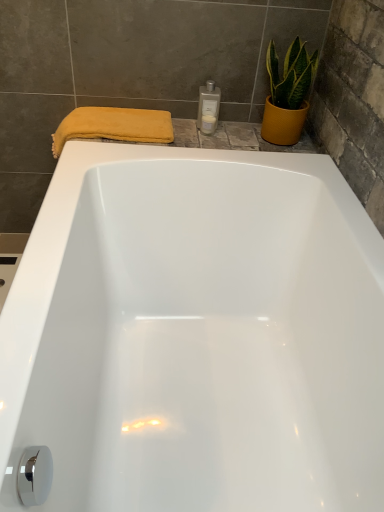
Question: Considering the relative positions of yellow soft towel at upper left and white glossy bottle at upper center, which is the first toiletry from bottom to top, in the image provided, is yellow soft towel at upper left in front of white glossy bottle at upper center, which is the first toiletry from bottom to top,?

Choices:
 (A) no
 (B) yes

Answer: (B)

Question: From a real-world perspective, is yellow soft towel at upper left physically above white glossy bottle at upper center, which is the first toiletry from bottom to top?

Choices:
 (A) no
 (B) yes

Answer: (A)

Question: Considering the relative positions of yellow soft towel at upper left and white glossy bottle at upper center, which is the first toiletry from bottom to top, in the image provided, is yellow soft towel at upper left to the right of white glossy bottle at upper center, which is the first toiletry from bottom to top, from the viewer's perspective?

Choices:
 (A) yes
 (B) no

Answer: (B)

Question: From the image's perspective, is yellow soft towel at upper left above white glossy bottle at upper center, which is the first toiletry from bottom to top?

Choices:
 (A) yes
 (B) no

Answer: (B)

Question: Could white glossy bottle at upper center, the second toiletry positioned from the top, be considered to be inside yellow soft towel at upper left?

Choices:
 (A) yes
 (B) no

Answer: (B)

Question: Considering the relative positions of yellow soft towel at upper left and white glossy bottle at upper right, which appears as the second toiletry when ordered from the bottom, in the image provided, is yellow soft towel at upper left to the left or to the right of white glossy bottle at upper right, which appears as the second toiletry when ordered from the bottom,?

Choices:
 (A) right
 (B) left

Answer: (B)

Question: Does point (107, 109) appear closer or farther from the camera than point (201, 96)?

Choices:
 (A) farther
 (B) closer

Answer: (B)

Question: In the image, is yellow soft towel at upper left positioned in front of or behind white glossy bottle at upper right, which ranks as the 1th toiletry in top-to-bottom order?

Choices:
 (A) behind
 (B) front

Answer: (B)

Question: Based on their sizes in the image, would you say yellow soft towel at upper left is bigger or smaller than white glossy bottle at upper right, which ranks as the 1th toiletry in top-to-bottom order?

Choices:
 (A) big
 (B) small

Answer: (A)

Question: Considering the positions of white glossy bottle at upper right, which appears as the second toiletry when ordered from the bottom, and white glossy bottle at upper center, which is the first toiletry from bottom to top, in the image, is white glossy bottle at upper right, which appears as the second toiletry when ordered from the bottom, wider or thinner than white glossy bottle at upper center, which is the first toiletry from bottom to top,?

Choices:
 (A) wide
 (B) thin

Answer: (A)

Question: From a real-world perspective, is white glossy bottle at upper right, which appears as the second toiletry when ordered from the bottom, physically located above or below white glossy bottle at upper center, which is the first toiletry from bottom to top?

Choices:
 (A) above
 (B) below

Answer: (A)

Question: Considering the positions of point (200, 96) and point (213, 102), is point (200, 96) closer or farther from the camera than point (213, 102)?

Choices:
 (A) closer
 (B) farther

Answer: (A)

Question: Would you say white glossy bottle at upper right, which appears as the second toiletry when ordered from the bottom, is to the left or to the right of white glossy bottle at upper center, the second toiletry positioned from the top, in the picture?

Choices:
 (A) left
 (B) right

Answer: (B)

Question: Is yellow textured pot at upper right in front of or behind white glossy bottle at upper center, the second toiletry positioned from the top, in the image?

Choices:
 (A) behind
 (B) front

Answer: (B)

Question: From a real-world perspective, is yellow textured pot at upper right positioned above or below white glossy bottle at upper center, the second toiletry positioned from the top?

Choices:
 (A) above
 (B) below

Answer: (A)